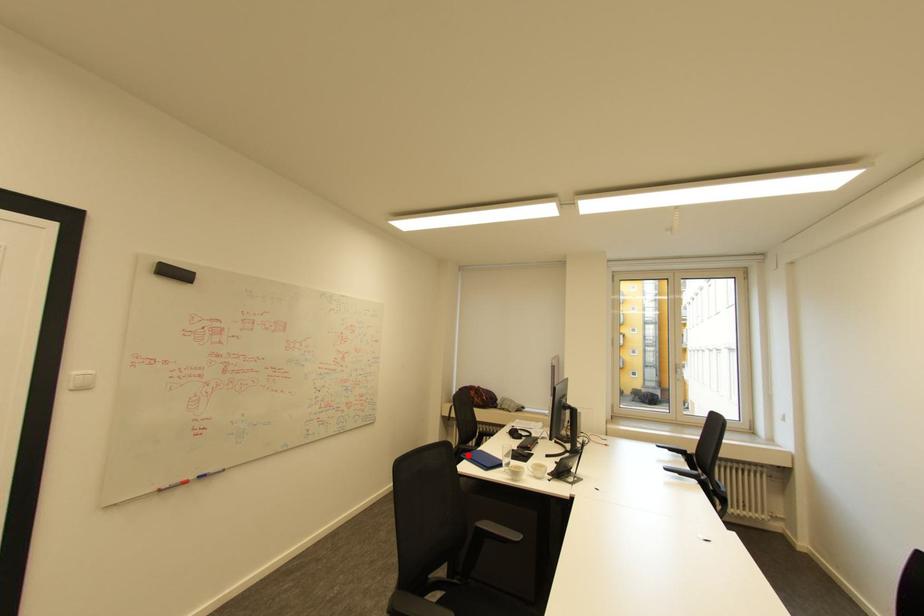
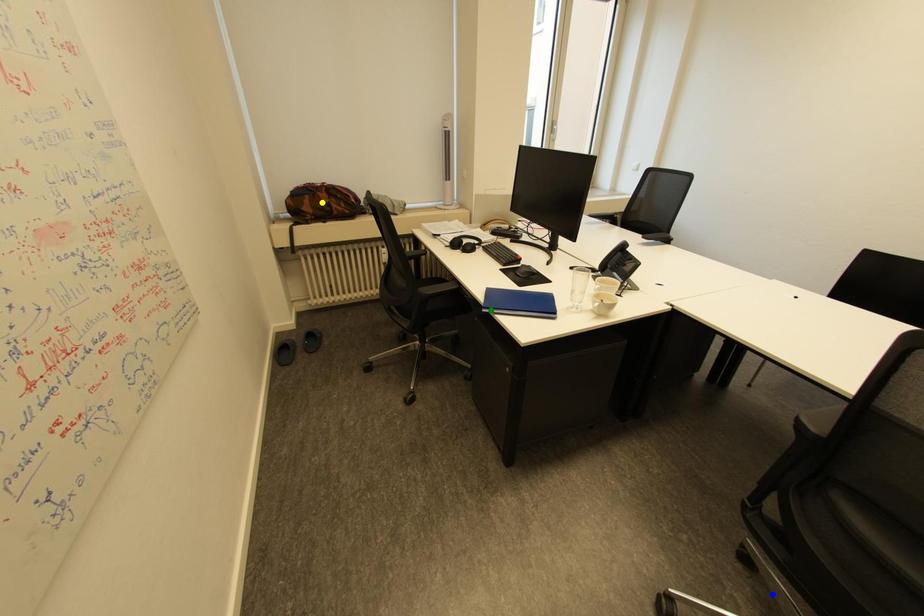
Question: I am providing you with two images of the same scene from different viewpoints. A red point is marked on the first image. You are given multiple points on the second image. Which mark in image 2 goes with the point in image 1?

Choices:
 (A) blue point
 (B) green point
 (C) yellow point

Answer: (B)